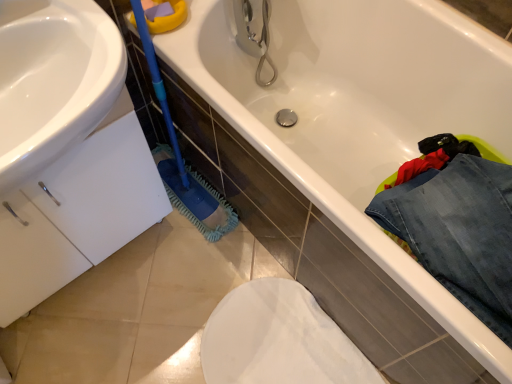
Question: Would you say blue microfiber brush at lower left is outside denim jeans at lower right?

Choices:
 (A) no
 (B) yes

Answer: (B)

Question: Can you confirm if blue microfiber brush at lower left is bigger than denim jeans at lower right?

Choices:
 (A) no
 (B) yes

Answer: (B)

Question: Considering the relative sizes of blue microfiber brush at lower left and denim jeans at lower right in the image provided, is blue microfiber brush at lower left wider than denim jeans at lower right?

Choices:
 (A) no
 (B) yes

Answer: (A)

Question: Does blue microfiber brush at lower left have a lesser width compared to denim jeans at lower right?

Choices:
 (A) yes
 (B) no

Answer: (A)

Question: Is denim jeans at lower right surrounded by blue microfiber brush at lower left?

Choices:
 (A) no
 (B) yes

Answer: (A)

Question: Is blue microfiber brush at lower left further to camera compared to denim jeans at lower right?

Choices:
 (A) no
 (B) yes

Answer: (A)

Question: Is denim jeans at lower right at the left side of blue microfiber brush at lower left?

Choices:
 (A) yes
 (B) no

Answer: (B)

Question: Is the depth of denim jeans at lower right greater than that of blue microfiber brush at lower left?

Choices:
 (A) yes
 (B) no

Answer: (A)

Question: From a real-world perspective, is denim jeans at lower right on blue microfiber brush at lower left?

Choices:
 (A) no
 (B) yes

Answer: (B)

Question: Is denim jeans at lower right closer to camera compared to blue microfiber brush at lower left?

Choices:
 (A) yes
 (B) no

Answer: (B)

Question: Can you confirm if denim jeans at lower right is wider than blue microfiber brush at lower left?

Choices:
 (A) yes
 (B) no

Answer: (A)

Question: Does denim jeans at lower right turn towards blue microfiber brush at lower left?

Choices:
 (A) no
 (B) yes

Answer: (A)

Question: Do you think denim jeans at lower right is within blue microfiber brush at lower left, or outside of it?

Choices:
 (A) inside
 (B) outside

Answer: (B)